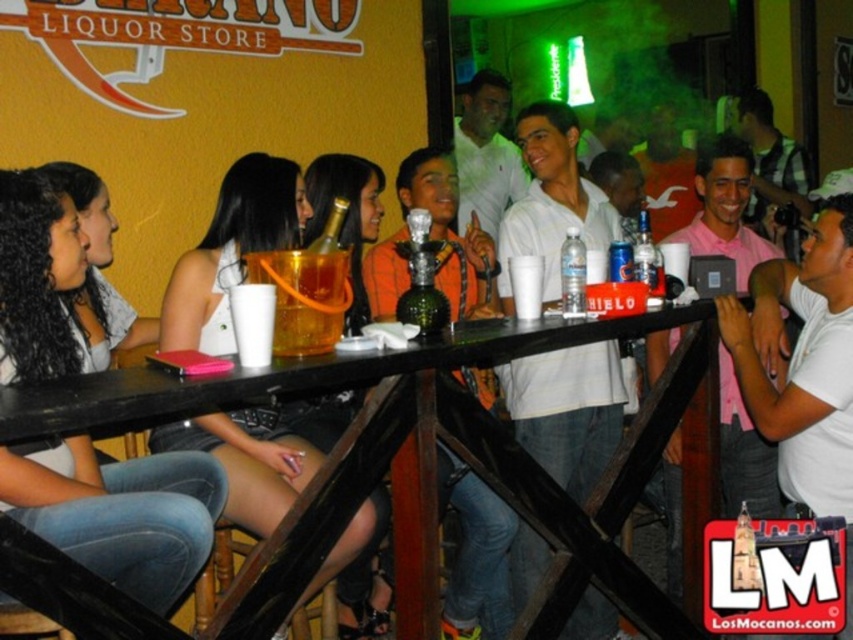
You are a customer in the liquor store and want to place a small item on the table. The table has limited space. Which object, the denim jeans at lower left or the white matte shirt at center, would you move to make more space?

The denim jeans at lower left has a greater width than the white matte shirt at center, so moving the denim jeans at lower left would free up more space.

You are at the liquor store and need to place both the matte black phone at center and the clear plastic bottle at bar center into your bag. Which object should you place first to ensure both fit?

The matte black phone at center is bigger than the clear plastic bottle at bar center, so you should place the matte black phone at center first to ensure both fit.

You are standing in the liquor store and want to pick up the denim jeans at lower left. What are the coordinates where you should look to find them?

The denim jeans at lower left are located at coordinates point (119,513).